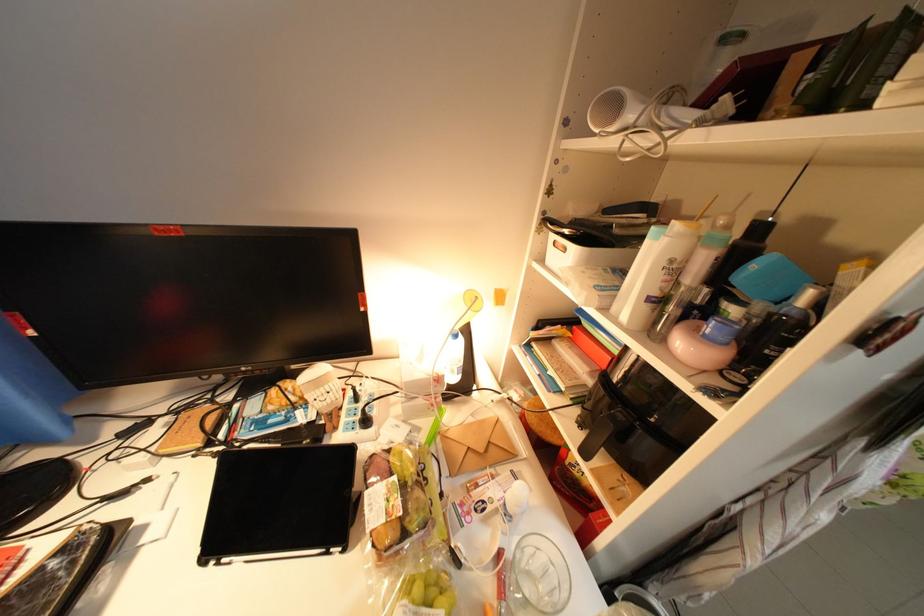
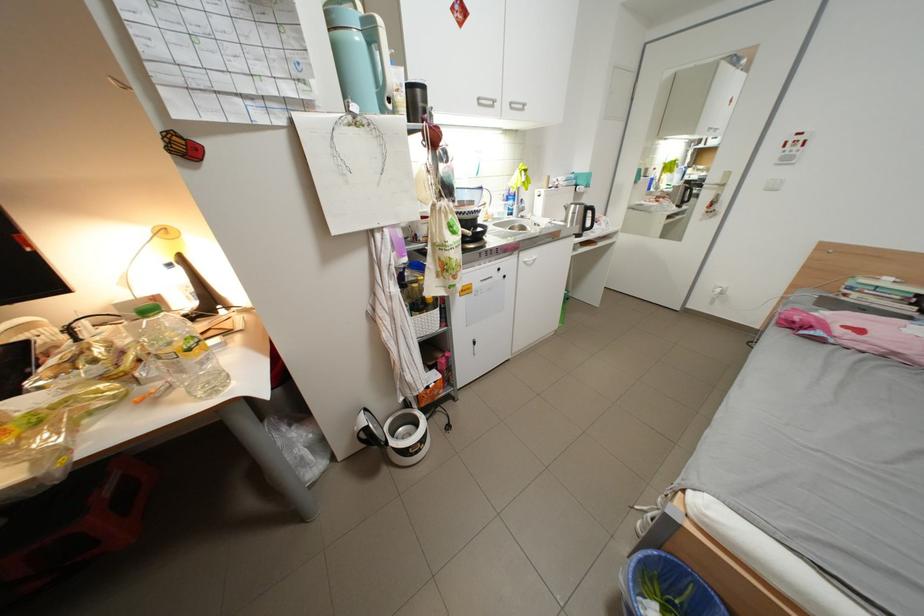
Question: The images are taken continuously from a first-person perspective. In which direction is your viewpoint rotating?

Choices:
 (A) Left
 (B) Right
 (C) Up
 (D) Down

Answer: (B)